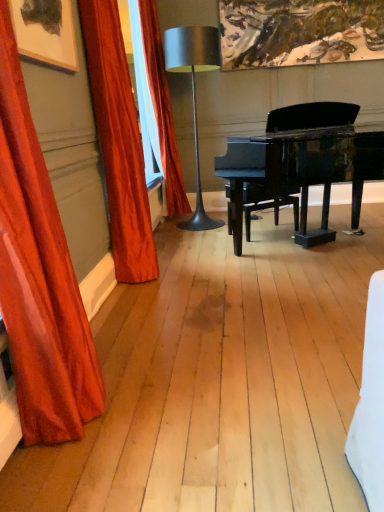
Question: From the image's perspective, is satin red curtain at left, arranged as the second curtain when viewed from the back, above or below metallic silver table lamp at center?

Choices:
 (A) above
 (B) below

Answer: (B)

Question: Is point (102, 49) positioned closer to the camera than point (201, 211)?

Choices:
 (A) farther
 (B) closer

Answer: (B)

Question: Estimate the real-world distances between objects in this image. Which object is farther from the satin orange curtain at left, the 1th curtain viewed from the back?

Choices:
 (A) satin red curtain at left, acting as the 2th curtain starting from the front
 (B) metallic silver table lamp at center
 (C) satin red curtain at left, acting as the 1th curtain starting from the front
 (D) black polished piano at center

Answer: (C)

Question: Which of these objects is positioned closest to the metallic silver table lamp at center?

Choices:
 (A) satin orange curtain at left, placed as the 3th curtain when sorted from front to back
 (B) black polished piano at center
 (C) satin red curtain at left, the third curtain from the back
 (D) satin red curtain at left, arranged as the second curtain when viewed from the back

Answer: (A)